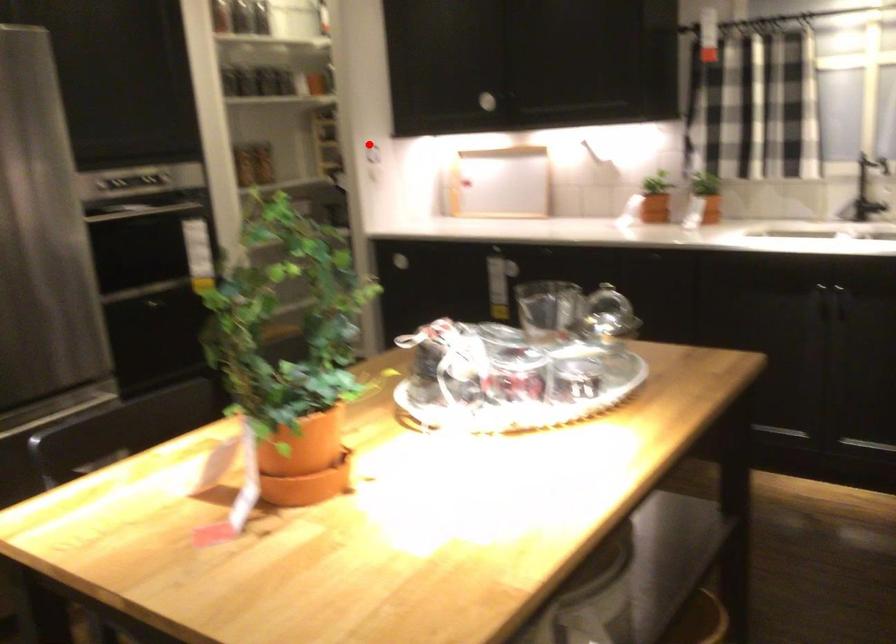
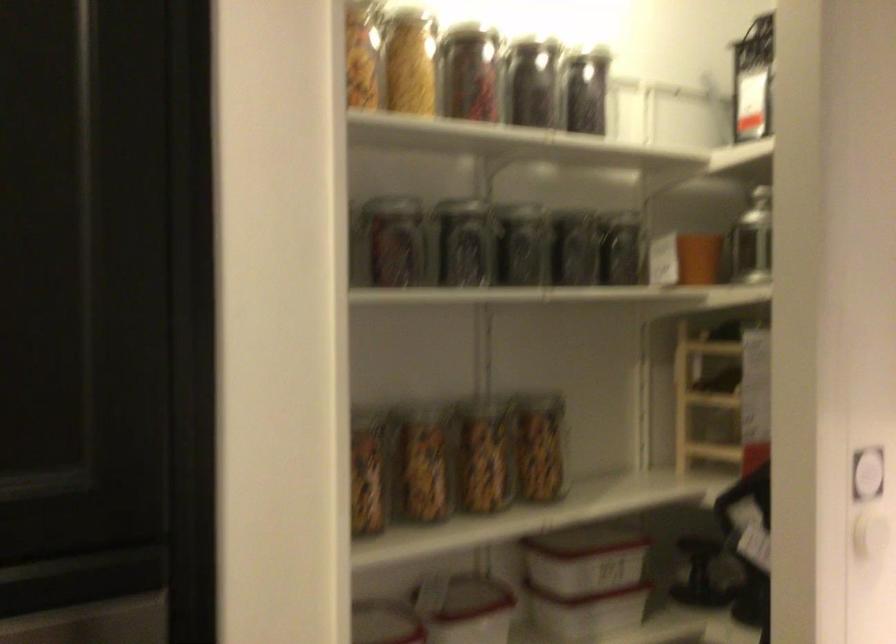
Question: I am providing you with two images of the same scene from different viewpoints. Given a red point in image1, look at the same physical point in image2. Is it:

Choices:
 (A) Closer to the viewpoint
 (B) Farther from the viewpoint

Answer: (A)